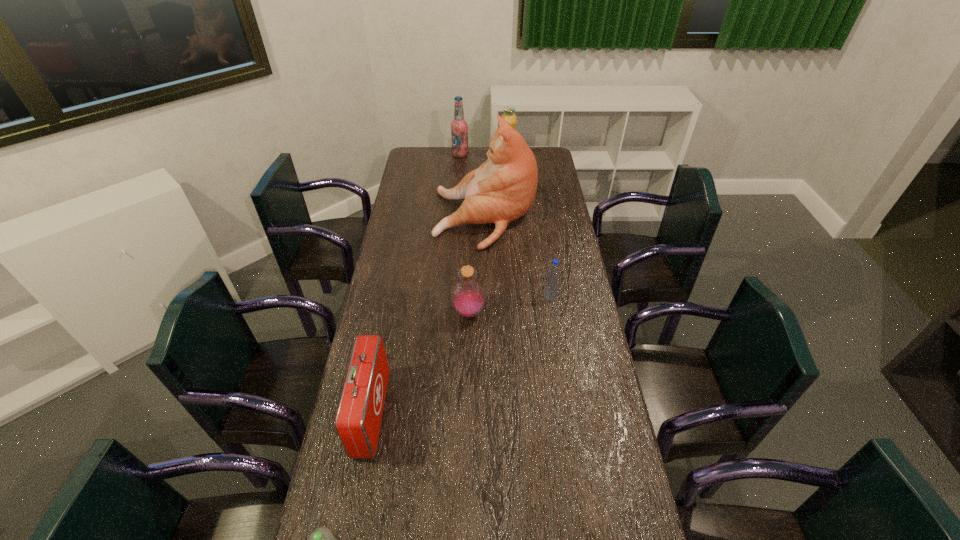
This screenshot has width=960, height=540. Identify the location of free spot between the farther water bottle and the bottle. (510, 304).

This screenshot has height=540, width=960. In order to click on object that stands as the fifth closest to the alcohol in this screenshot , I will do (358, 419).

Identify the location of object that can be found as the closest to the bottle. This screenshot has width=960, height=540. (552, 281).

Image resolution: width=960 pixels, height=540 pixels. Find the location of `vacant space that satisfies the following two spatial constraints: 1. on the face of the cat; 2. on the back side of the right water bottle`. vacant space that satisfies the following two spatial constraints: 1. on the face of the cat; 2. on the back side of the right water bottle is located at coordinates (486, 295).

At what (x,y) coordinates should I click in order to perform the action: click on blank space that satisfies the following two spatial constraints: 1. on the face of the tallest object; 2. on the left side of the farther water bottle. Please return your answer as a coordinate pair (x, y). This screenshot has height=540, width=960. Looking at the image, I should click on (486, 295).

This screenshot has height=540, width=960. In order to click on free location that satisfies the following two spatial constraints: 1. on the front label of the farther water bottle; 2. on the left side of the fruit juice in this screenshot , I will do `click(518, 295)`.

Where is `vacant space that satisfies the following two spatial constraints: 1. on the front label of the fruit juice; 2. on the face of the fifth nearest object`? Image resolution: width=960 pixels, height=540 pixels. vacant space that satisfies the following two spatial constraints: 1. on the front label of the fruit juice; 2. on the face of the fifth nearest object is located at coordinates (512, 219).

The image size is (960, 540). In order to click on vacant area that satisfies the following two spatial constraints: 1. on the face of the right water bottle; 2. on the right side of the fifth nearest object in this screenshot , I will do `click(486, 295)`.